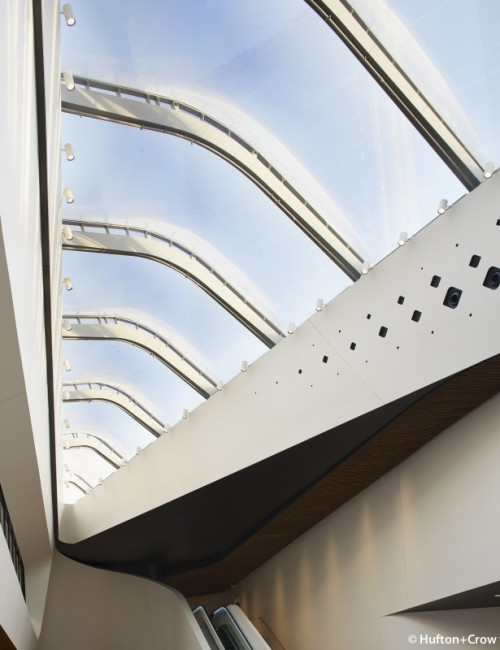
I want to click on window, so click(x=12, y=537).